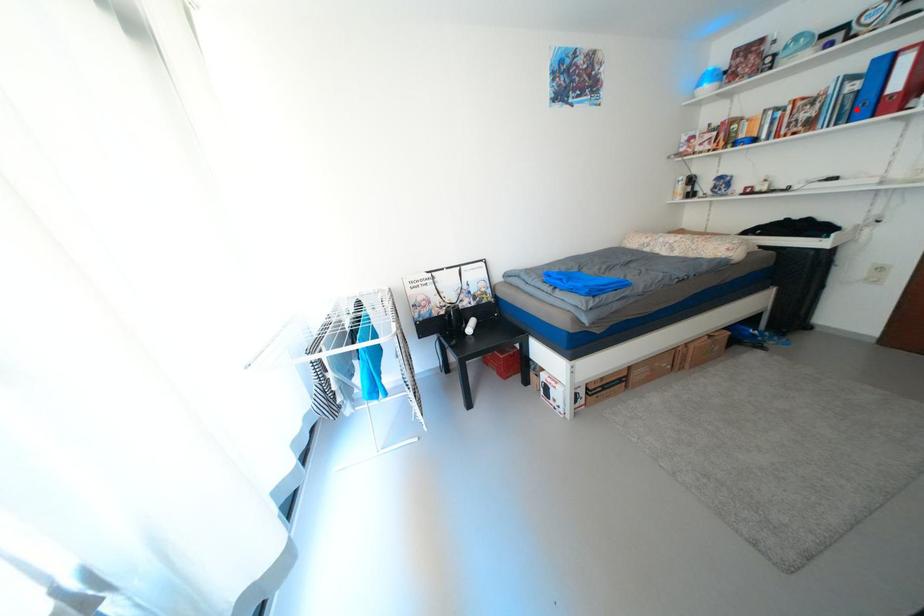
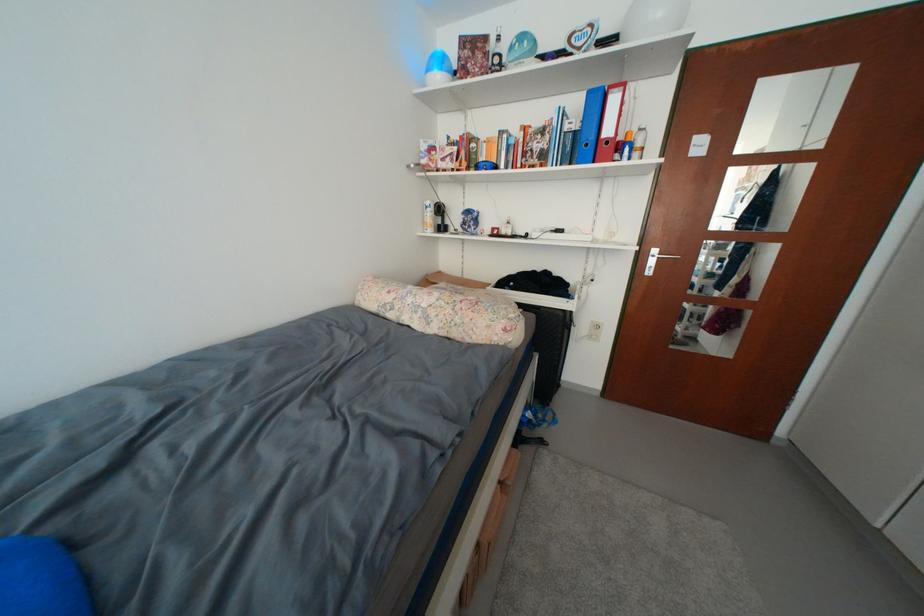
Question: I am providing you with two images of the same scene from different viewpoints. Image1 has a red point marked. In image2, the corresponding 3D location appears at what relative position? Reply with the corresponding letter.

Choices:
 (A) Closer
 (B) Farther

Answer: (A)